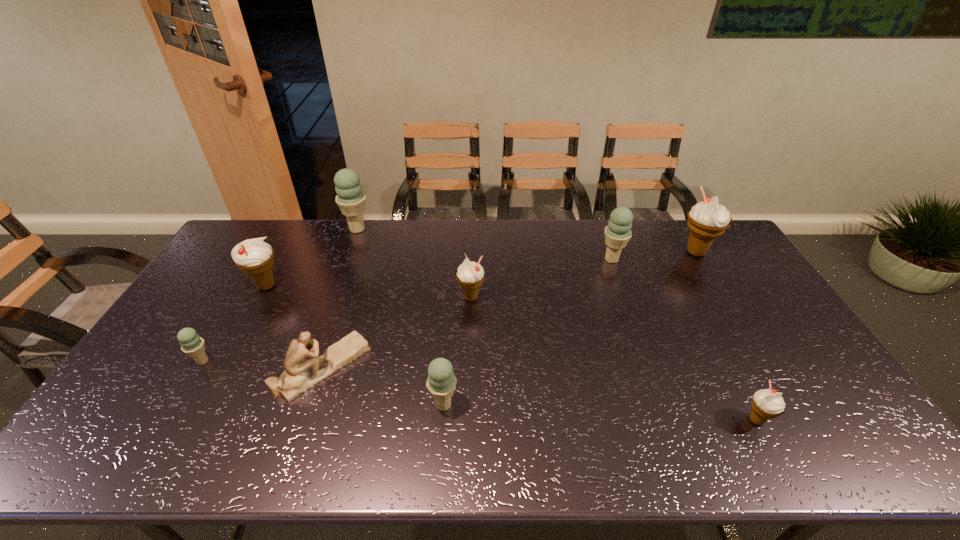
Where is `the smallest blue ice cream`? The height and width of the screenshot is (540, 960). the smallest blue ice cream is located at coordinates tap(192, 344).

At what (x,y) coordinates should I click in order to perform the action: click on the third nearest icecream. Please return your answer as a coordinate pair (x, y). Looking at the image, I should click on (192, 344).

At what (x,y) coordinates should I click in order to perform the action: click on the nearest white icecream. Please return your answer as a coordinate pair (x, y). Looking at the image, I should click on (767, 404).

Image resolution: width=960 pixels, height=540 pixels. Identify the location of vacant region located on the left of the farthest icecream. (276, 230).

At what (x,y) coordinates should I click in order to perform the action: click on vacant position located 0.390m on the left of the biggest white icecream. Please return your answer as a coordinate pair (x, y). The image size is (960, 540). Looking at the image, I should click on (569, 252).

Locate an element on the screen. vacant space located on the front of the second biggest blue ice cream is located at coordinates (627, 302).

Find the location of a particular element. free region located 0.220m on the back of the leftmost white icecream is located at coordinates (293, 237).

Find the location of a particular element. Image resolution: width=960 pixels, height=540 pixels. blank space located 0.080m on the back of the third biggest white icecream is located at coordinates (471, 272).

The height and width of the screenshot is (540, 960). In order to click on free space located on the back of the second smallest blue ice cream in this screenshot , I will do `click(450, 306)`.

Locate an element on the screen. free point located on the front-facing side of the figurine is located at coordinates (418, 367).